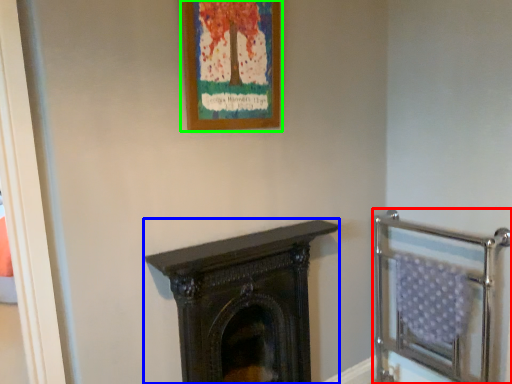
Question: Which is farther away from balustrade (highlighted by a red box)? fireplace (highlighted by a blue box) or picture frame (highlighted by a green box)?

Choices:
 (A) fireplace
 (B) picture frame

Answer: (B)